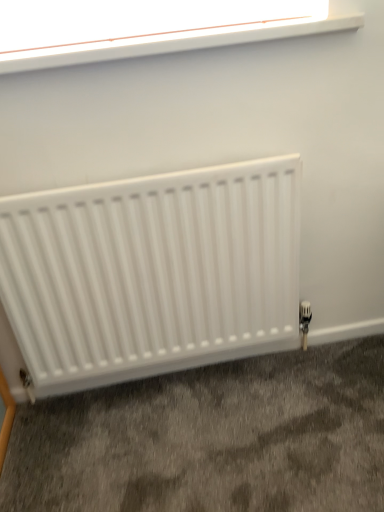
Question: Should I look upward or downward to see white plastic window at upper center?

Choices:
 (A) up
 (B) down

Answer: (A)

Question: Is white matte radiator at lower center at the right side of white plastic window at upper center?

Choices:
 (A) no
 (B) yes

Answer: (A)

Question: Could you tell me if white matte radiator at lower center is facing white plastic window at upper center?

Choices:
 (A) yes
 (B) no

Answer: (B)

Question: Is the position of white matte radiator at lower center less distant than that of white plastic window at upper center?

Choices:
 (A) no
 (B) yes

Answer: (A)

Question: From a real-world perspective, is white matte radiator at lower center physically above white plastic window at upper center?

Choices:
 (A) yes
 (B) no

Answer: (B)

Question: Is white matte radiator at lower center located outside white plastic window at upper center?

Choices:
 (A) no
 (B) yes

Answer: (B)

Question: Is white matte radiator at lower center looking in the opposite direction of white plastic window at upper center?

Choices:
 (A) no
 (B) yes

Answer: (A)

Question: Is white plastic window at upper center shorter than white matte radiator at lower center?

Choices:
 (A) no
 (B) yes

Answer: (B)

Question: Could you tell me if white plastic window at upper center is facing white matte radiator at lower center?

Choices:
 (A) no
 (B) yes

Answer: (A)

Question: Does white plastic window at upper center have a lesser width compared to white matte radiator at lower center?

Choices:
 (A) no
 (B) yes

Answer: (A)

Question: Is white matte radiator at lower center completely or partially inside white plastic window at upper center?

Choices:
 (A) no
 (B) yes

Answer: (A)

Question: From the image's perspective, is white plastic window at upper center below white matte radiator at lower center?

Choices:
 (A) no
 (B) yes

Answer: (A)

Question: Considering the relative sizes of white plastic window at upper center and white matte radiator at lower center in the image provided, is white plastic window at upper center wider than white matte radiator at lower center?

Choices:
 (A) no
 (B) yes

Answer: (B)

Question: Considering the positions of white matte radiator at lower center and white plastic window at upper center in the image, is white matte radiator at lower center taller or shorter than white plastic window at upper center?

Choices:
 (A) tall
 (B) short

Answer: (A)